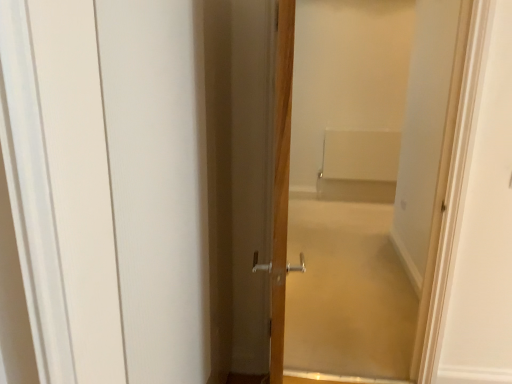
Question: From their relative heights in the image, would you say white matte barn door at left is taller or shorter than wooden door at center, placed as the 1th door when sorted from right to left?

Choices:
 (A) short
 (B) tall

Answer: (A)

Question: From the image's perspective, relative to wooden door at center, which is counted as the second door, starting from the left, is white matte barn door at left above or below?

Choices:
 (A) below
 (B) above

Answer: (A)

Question: Considering the real-world distances, which object is closest to the wooden door at center, which is counted as the second door, starting from the left?

Choices:
 (A) wooden door at center, marked as the 1th door in a left-to-right arrangement
 (B) white matte barn door at left
 (C) white matte bath at center

Answer: (A)

Question: Which object is the farthest from the wooden door at center, placed as the 1th door when sorted from right to left?

Choices:
 (A) white matte barn door at left
 (B) wooden door at center, positioned as the 2th door in right-to-left order
 (C) white matte bath at center

Answer: (C)